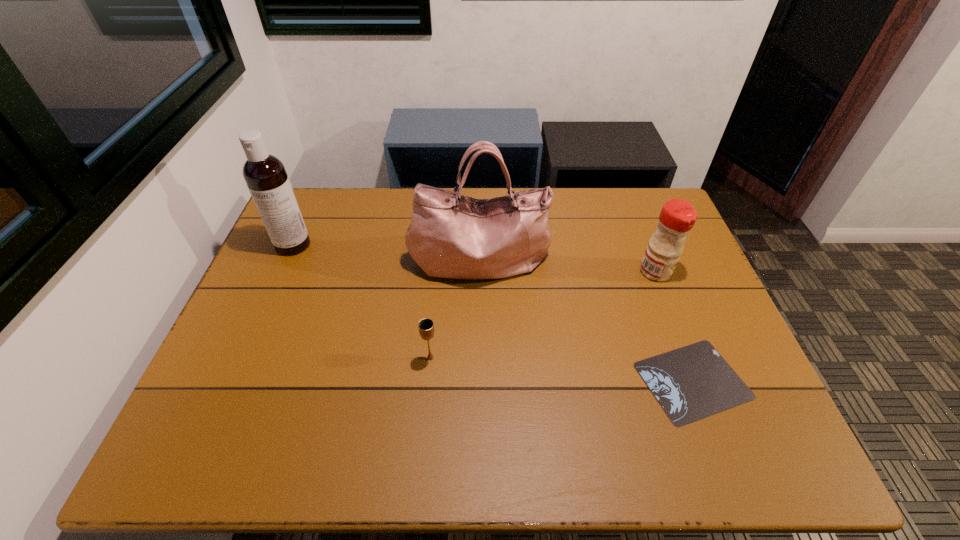
The height and width of the screenshot is (540, 960). Find the location of `unoccupied area between the third tallest object and the second shortest object`. unoccupied area between the third tallest object and the second shortest object is located at coordinates (543, 315).

This screenshot has width=960, height=540. Identify the location of free spot between the fourth tallest object and the leftmost object. (362, 301).

Locate an element on the screen. free space between the dishwasher detergent and the chalice is located at coordinates (362, 301).

What are the coordinates of `free spot between the shortest object and the chalice` in the screenshot? It's located at (562, 369).

Point out which object is positioned as the fourth nearest to the condiment. Please provide its 2D coordinates. Your answer should be formatted as a tuple, i.e. [(x, y)], where the tuple contains the x and y coordinates of a point satisfying the conditions above.

[(265, 175)]

The width and height of the screenshot is (960, 540). Find the location of `object that stands as the fourth closest to the condiment`. object that stands as the fourth closest to the condiment is located at coordinates (265, 175).

Where is `vacant space that satisfies the following two spatial constraints: 1. on the label side of the leftmost object; 2. on the right side of the condiment`? vacant space that satisfies the following two spatial constraints: 1. on the label side of the leftmost object; 2. on the right side of the condiment is located at coordinates (281, 272).

Identify the location of free region that satisfies the following two spatial constraints: 1. on the label side of the second shortest object; 2. on the right side of the leftmost object. (244, 357).

Identify the location of free region that satisfies the following two spatial constraints: 1. on the label side of the leftmost object; 2. on the right side of the chalice. The image size is (960, 540). (244, 357).

Locate an element on the screen. vacant area that satisfies the following two spatial constraints: 1. at the front of the shortest object with handles; 2. on the right side of the handbag is located at coordinates (479, 381).